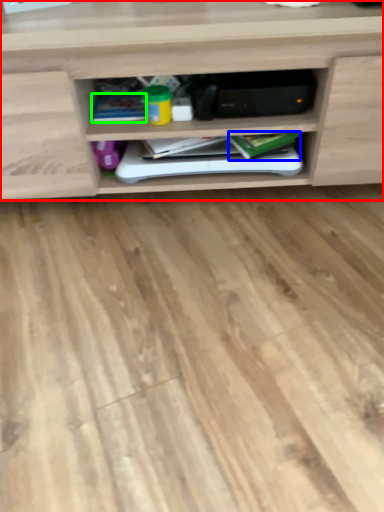
Question: Which object is the farthest from shelf (highlighted by a red box)? Choose among these: book (highlighted by a blue box) or book (highlighted by a green box).

Choices:
 (A) book
 (B) book

Answer: (A)